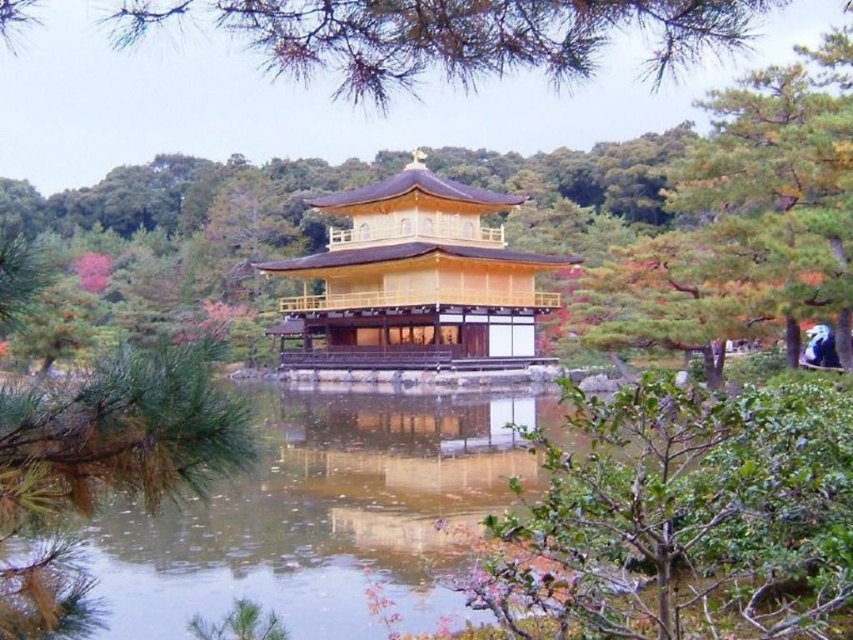
The width and height of the screenshot is (853, 640). I want to click on clear water at center, so click(325, 516).

Is clear water at center smaller than golden polished wood temple at center?

Yes, clear water at center is smaller than golden polished wood temple at center.

Between point (247, 515) and point (331, 356), which one is positioned in front?

Positioned in front is point (247, 515).

The width and height of the screenshot is (853, 640). In order to click on clear water at center in this screenshot , I will do `click(325, 516)`.

Measure the distance between point (347, 621) and camera.

The distance of point (347, 621) from camera is 10.70 meters.

Is clear water at center further to the viewer compared to green needle-like leaves at upper center?

No, clear water at center is in front of green needle-like leaves at upper center.

Between point (564, 435) and point (642, 77), which one is positioned in front?

Point (564, 435)

Where is `clear water at center`? clear water at center is located at coordinates (325, 516).

Looking at this image, who is lower down, golden polished wood temple at center or green needle-like leaves at upper center?

golden polished wood temple at center is lower down.

This screenshot has width=853, height=640. Describe the element at coordinates (415, 282) in the screenshot. I see `golden polished wood temple at center` at that location.

Who is more distant from viewer, (415,259) or (125,22)?

The point (415,259) is more distant.

Locate an element on the screen. The height and width of the screenshot is (640, 853). golden polished wood temple at center is located at coordinates (415, 282).